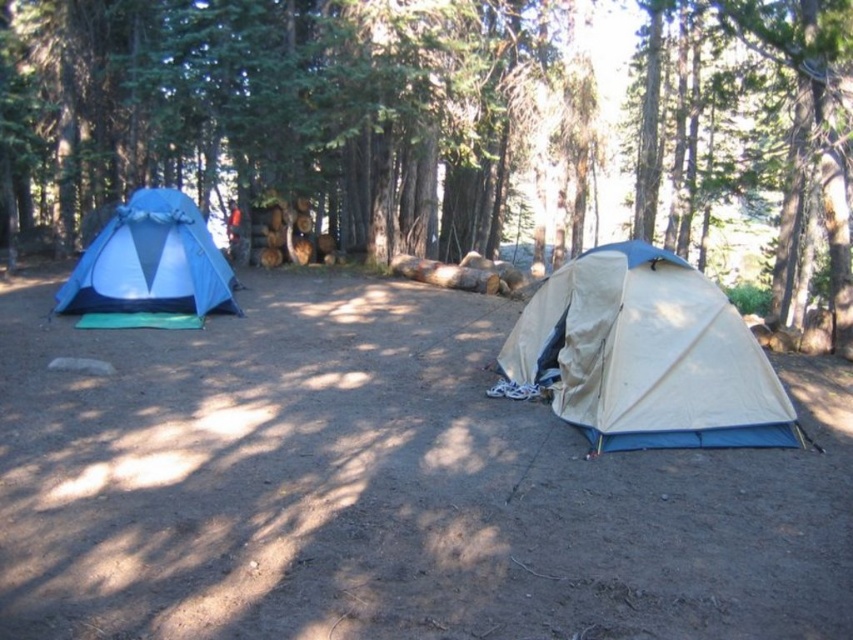
Question: Which object is farther from the camera taking this photo?

Choices:
 (A) beige fabric tent at center
 (B) matte blue tent at left
 (C) green matte tent at left

Answer: (B)

Question: Which is nearer to the green matte tent at left?

Choices:
 (A) matte blue tent at left
 (B) beige fabric tent at center

Answer: (A)

Question: Is beige fabric tent at center below matte blue tent at left?

Choices:
 (A) yes
 (B) no

Answer: (A)

Question: Is beige fabric tent at center below matte blue tent at left?

Choices:
 (A) yes
 (B) no

Answer: (A)

Question: Estimate the real-world distances between objects in this image. Which object is closer to the beige fabric tent at center?

Choices:
 (A) green matte tent at left
 (B) matte blue tent at left

Answer: (B)

Question: Where is beige fabric tent at center located in relation to matte blue tent at left in the image?

Choices:
 (A) above
 (B) below

Answer: (B)